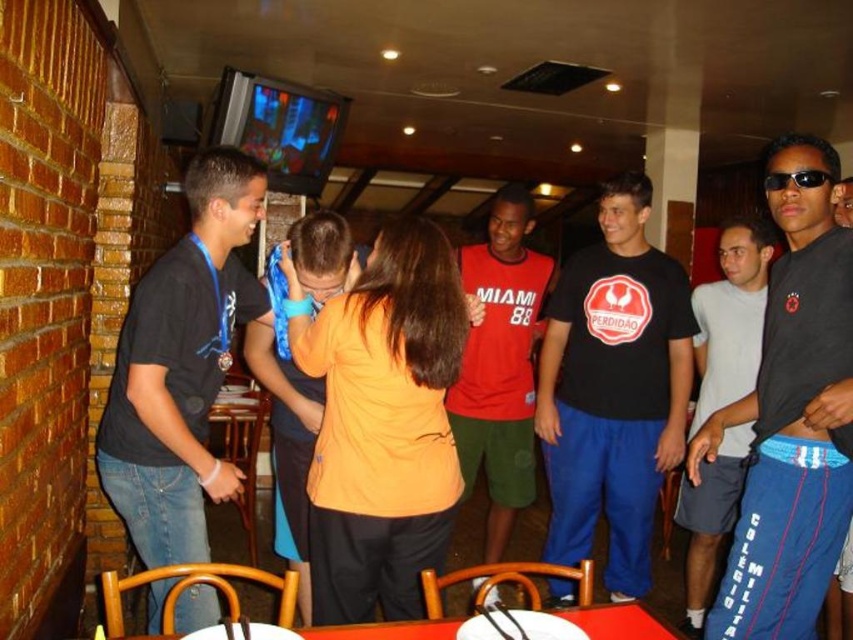
Does red matte shirt at center have a lesser height compared to white cotton shirt at center?

In fact, red matte shirt at center may be taller than white cotton shirt at center.

Is point (462, 403) farther from camera compared to point (759, 250)?

Yes, it is.

Find the location of a particular element. red matte shirt at center is located at coordinates (500, 364).

Which is more to the left, orange matte shirt at center or red matte shirt at center?

orange matte shirt at center

The image size is (853, 640). I want to click on orange matte shirt at center, so click(384, 426).

Who is higher up, black matte t-shirt at center or smooth plastic table at center?

black matte t-shirt at center is above.

Is point (618, 419) less distant than point (320, 637)?

That is False.

The width and height of the screenshot is (853, 640). In order to click on black matte t-shirt at center in this screenshot , I will do `click(613, 388)`.